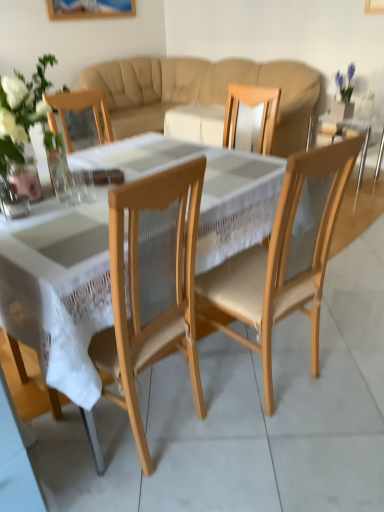
This screenshot has height=512, width=384. I want to click on vacant space that is to the left of transparent glass at center, which is counted as the first tableware, starting from the right, so (43, 205).